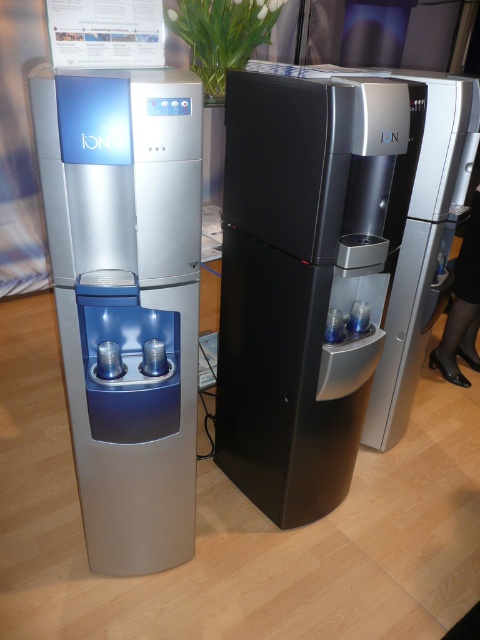
Is black matte water cooler at center to the left of satin silver water dispenser at left from the viewer's perspective?

Incorrect, black matte water cooler at center is not on the left side of satin silver water dispenser at left.

Is black matte water cooler at center positioned before satin silver water dispenser at left?

No, it is behind satin silver water dispenser at left.

Who is more forward, (349,154) or (168,460)?

Point (349,154)

Image resolution: width=480 pixels, height=640 pixels. In order to click on black matte water cooler at center in this screenshot , I will do `click(305, 276)`.